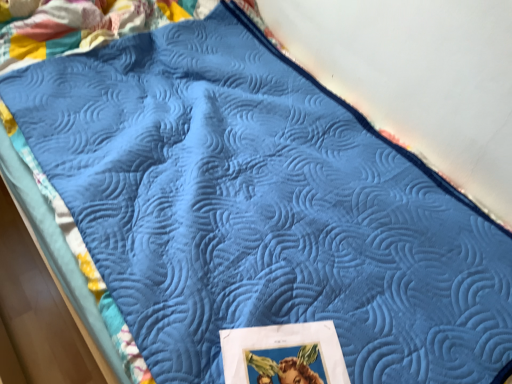
This screenshot has width=512, height=384. Describe the element at coordinates (285, 352) in the screenshot. I see `white paper at center` at that location.

This screenshot has width=512, height=384. What are the coordinates of `white paper at center` in the screenshot? It's located at (285, 352).

The image size is (512, 384). Identify the location of white paper at center. (285, 352).